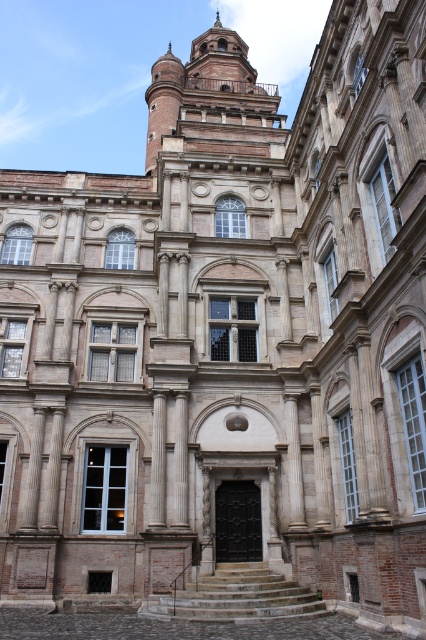
Which of these two, brown stone tower at upper center or matte white clock at upper center, stands shorter?

matte white clock at upper center

Which is behind, point (178, 115) or point (207, 188)?

Positioned behind is point (178, 115).

Where is `brown stone tower at upper center`? Image resolution: width=426 pixels, height=640 pixels. brown stone tower at upper center is located at coordinates (204, 84).

Find the location of a particular element. brown stone tower at upper center is located at coordinates (204, 84).